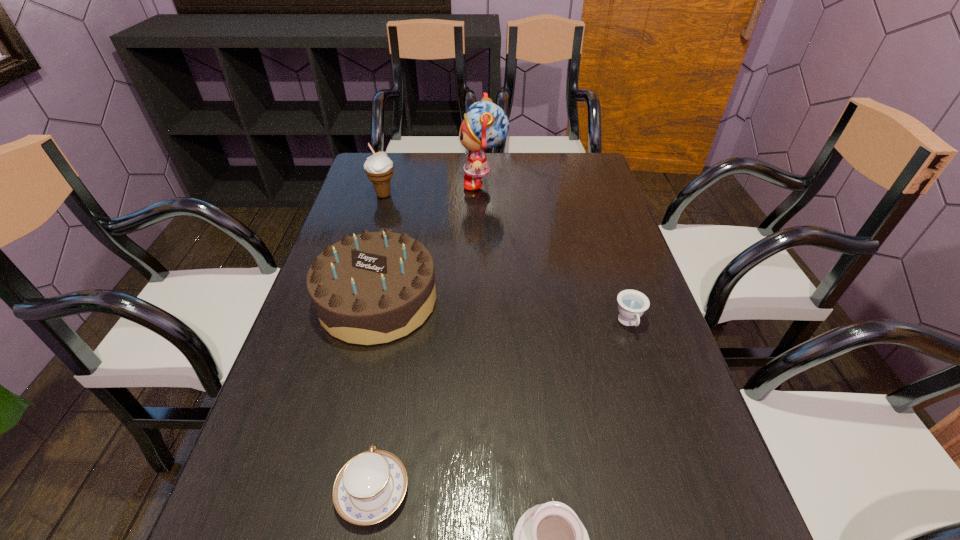
In order to click on object located in the far left corner section of the desktop in this screenshot , I will do `click(379, 168)`.

Where is `free space at the far edge of the desktop`? This screenshot has width=960, height=540. free space at the far edge of the desktop is located at coordinates [449, 172].

Locate an element on the screen. The image size is (960, 540). free region at the left edge of the desktop is located at coordinates (360, 194).

At what (x,y) coordinates should I click in order to perform the action: click on free region at the right edge. Please return your answer as a coordinate pair (x, y). This screenshot has height=540, width=960. Looking at the image, I should click on (662, 333).

The width and height of the screenshot is (960, 540). In order to click on vacant point located between the leftmost teacup and the rightmost object in this screenshot , I will do `click(500, 407)`.

The height and width of the screenshot is (540, 960). What are the coordinates of `free point between the leftmost teacup and the doll` in the screenshot? It's located at (428, 337).

At what (x,y) coordinates should I click in order to perform the action: click on empty location between the rightmost object and the birthday cake. Please return your answer as a coordinate pair (x, y). This screenshot has height=540, width=960. Looking at the image, I should click on (503, 312).

At what (x,y) coordinates should I click in order to perform the action: click on object that is the third nearest to the tallest object. Please return your answer as a coordinate pair (x, y). This screenshot has width=960, height=540. Looking at the image, I should click on (631, 303).

Locate which object ranks in proximity to the second teacup from right to left. Please provide its 2D coordinates. Your answer should be formatted as a tuple, i.e. [(x, y)], where the tuple contains the x and y coordinates of a point satisfying the conditions above.

[(370, 486)]

Identify which teacup is the nearest to the rightmost object. Please provide its 2D coordinates. Your answer should be formatted as a tuple, i.e. [(x, y)], where the tuple contains the x and y coordinates of a point satisfying the conditions above.

[(549, 539)]